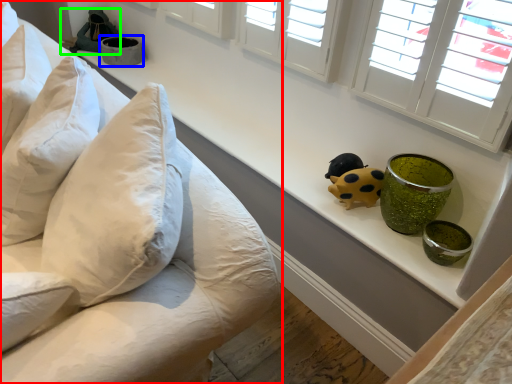
Question: Which object is the closest to the furniture (highlighted by a red box)? Choose among these: glass bowl (highlighted by a blue box) or toy (highlighted by a green box).

Choices:
 (A) glass bowl
 (B) toy

Answer: (A)